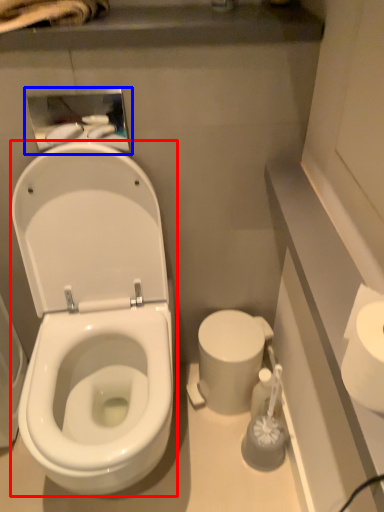
Question: Which object appears farthest to the camera in this image, wide (highlighted by a red box) or medicine cabinet (highlighted by a blue box)?

Choices:
 (A) wide
 (B) medicine cabinet

Answer: (B)